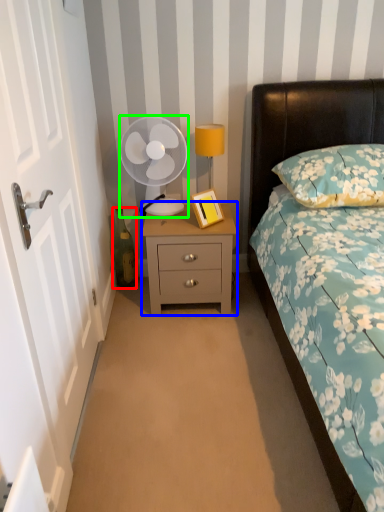
Question: Which object is the closest to the bottle (highlighted by a red box)? Choose among these: nightstand (highlighted by a blue box) or mechanical fan (highlighted by a green box).

Choices:
 (A) nightstand
 (B) mechanical fan

Answer: (B)